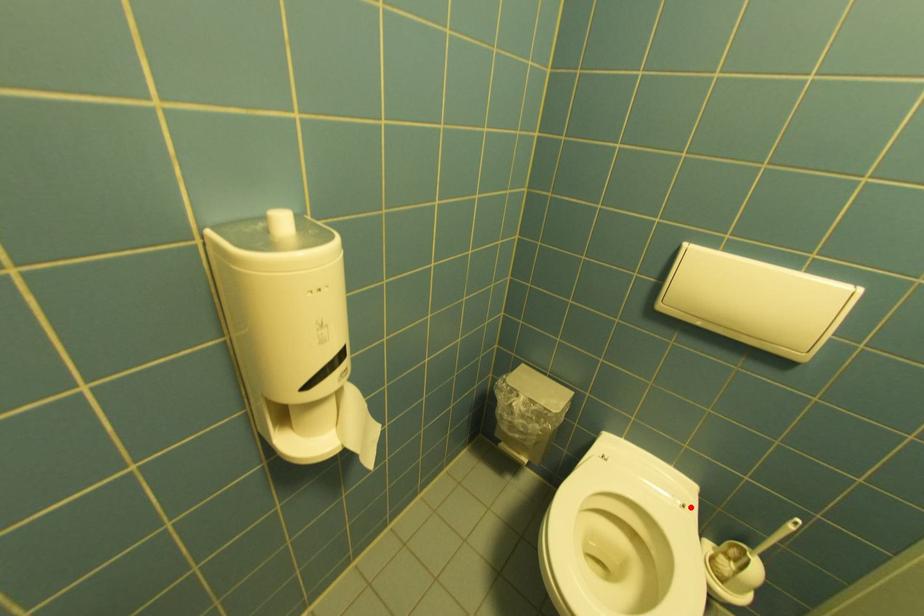
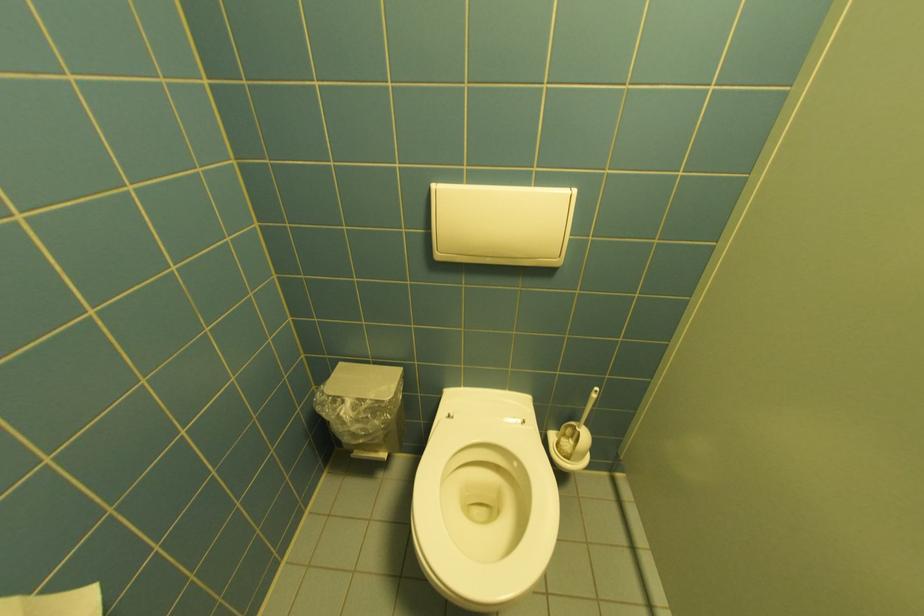
The point at the highlighted location is marked in the first image. Where is the corresponding point in the second image?

(529, 424)